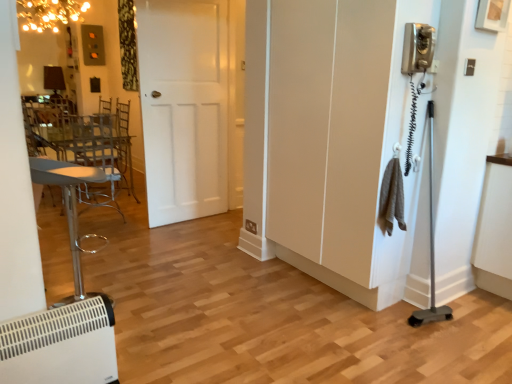
Identify the location of vacant space situated on the left part of white matte screen door at right. (238, 291).